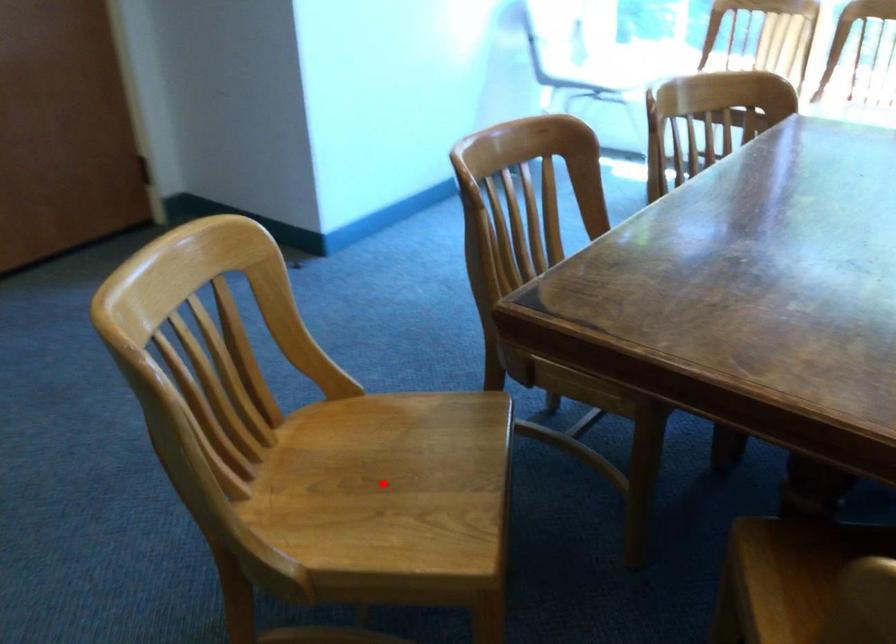
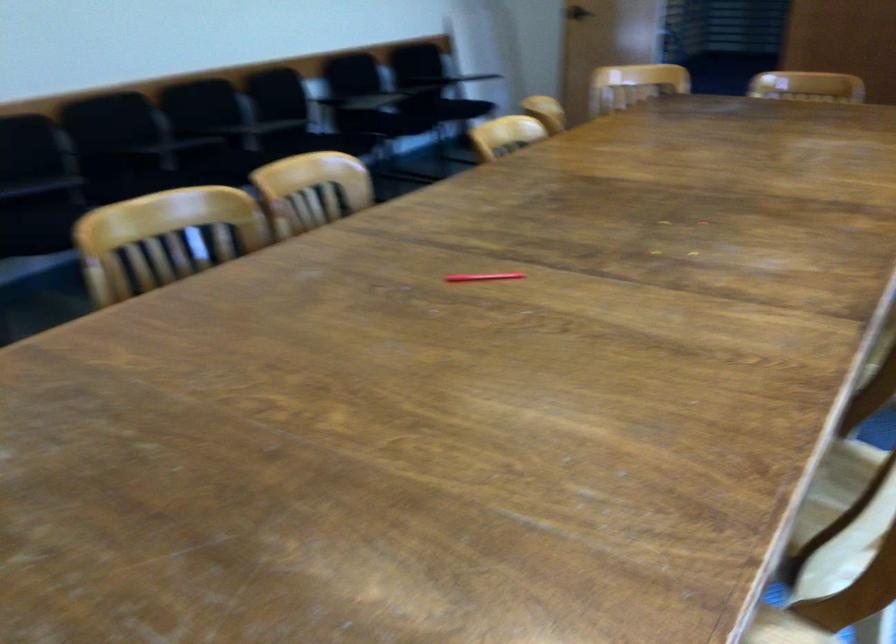
Question: I am providing you with two images of the same scene from different viewpoints. A red point is marked on the first image. Can you still see the location of the red point in image 2?

Choices:
 (A) Yes
 (B) No

Answer: (B)